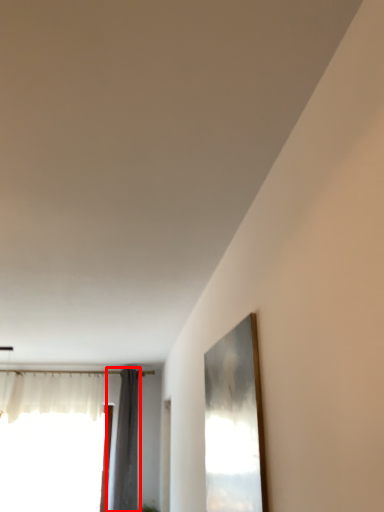
Question: Where is curtain (annotated by the red box) located in relation to window in the image?

Choices:
 (A) right
 (B) left

Answer: (A)